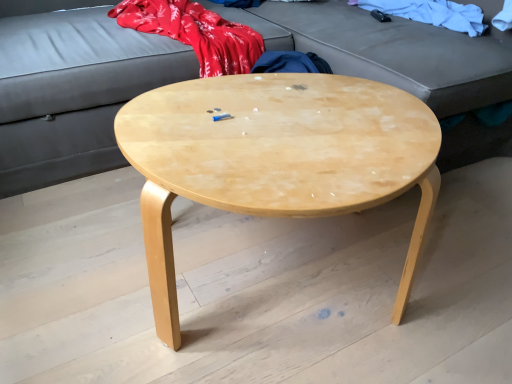
You are a GUI agent. You are given a task and a screenshot of the screen. Output one action in this format:
    pyautogui.click(x=<x>, y=<y>)
    Task: Click on the vacant space to the right of natural wood coffee table at center
    
    Given the screenshot: What is the action you would take?
    [x=458, y=256]